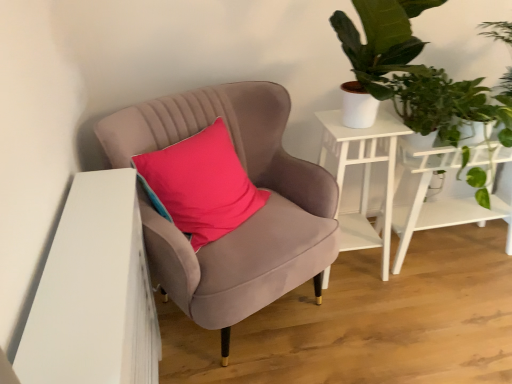
Identify the location of vacant space underneath white wood side table at upper right, arranged as the 1th table when viewed from the left (from a real-world perspective). (354, 266).